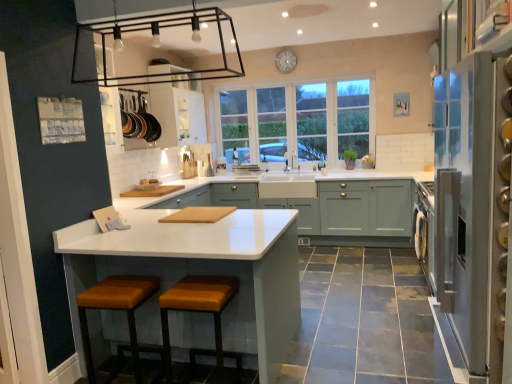
Question: Which direction should I rotate to look at matte green cabinets at center, the 2th cabinetry when ordered from left to right, — up or down?

Choices:
 (A) down
 (B) up

Answer: (A)

Question: From the image's perspective, does matte green cabinets at center, the 2th cabinetry when ordered from left to right, appear higher than white glossy cabinet at upper center, marked as the first cabinetry in a left-to-right arrangement?

Choices:
 (A) yes
 (B) no

Answer: (B)

Question: From a real-world perspective, is matte green cabinets at center, the 2th cabinetry when ordered from left to right, located higher than white glossy cabinet at upper center, marked as the 1th cabinetry in a top-to-bottom arrangement?

Choices:
 (A) yes
 (B) no

Answer: (B)

Question: Does matte green cabinets at center, which is the 1th cabinetry from bottom to top, have a lesser width compared to white glossy cabinet at upper center, which is the second cabinetry in right-to-left order?

Choices:
 (A) no
 (B) yes

Answer: (A)

Question: Does matte green cabinets at center, which is the 1th cabinetry from bottom to top, have a smaller size compared to white glossy cabinet at upper center, marked as the first cabinetry in a left-to-right arrangement?

Choices:
 (A) no
 (B) yes

Answer: (A)

Question: Considering the relative positions of matte green cabinets at center, the 2th cabinetry when ordered from top to bottom, and white glossy cabinet at upper center, marked as the 1th cabinetry in a top-to-bottom arrangement, in the image provided, is matte green cabinets at center, the 2th cabinetry when ordered from top to bottom, in front of white glossy cabinet at upper center, marked as the 1th cabinetry in a top-to-bottom arrangement,?

Choices:
 (A) no
 (B) yes

Answer: (B)

Question: Does matte green cabinets at center, the 2th cabinetry when ordered from left to right, have a larger size compared to white glossy cabinet at upper center, which is the second cabinetry in right-to-left order?

Choices:
 (A) yes
 (B) no

Answer: (A)

Question: Is white glossy countertop at center surrounding white matte clock at upper center?

Choices:
 (A) yes
 (B) no

Answer: (B)

Question: From a real-world perspective, is white glossy countertop at center physically below white matte clock at upper center?

Choices:
 (A) yes
 (B) no

Answer: (A)

Question: From the image's perspective, is white glossy countertop at center over white matte clock at upper center?

Choices:
 (A) no
 (B) yes

Answer: (A)

Question: Is white glossy countertop at center not within white matte clock at upper center?

Choices:
 (A) yes
 (B) no

Answer: (A)

Question: Are white glossy countertop at center and white matte clock at upper center beside each other?

Choices:
 (A) no
 (B) yes

Answer: (A)

Question: Is the position of white glossy countertop at center less distant than that of white matte clock at upper center?

Choices:
 (A) yes
 (B) no

Answer: (A)

Question: Is orange fabric stool at lower center, the 1th step stool in the right-to-left sequence, outside white glass window at center?

Choices:
 (A) no
 (B) yes

Answer: (B)